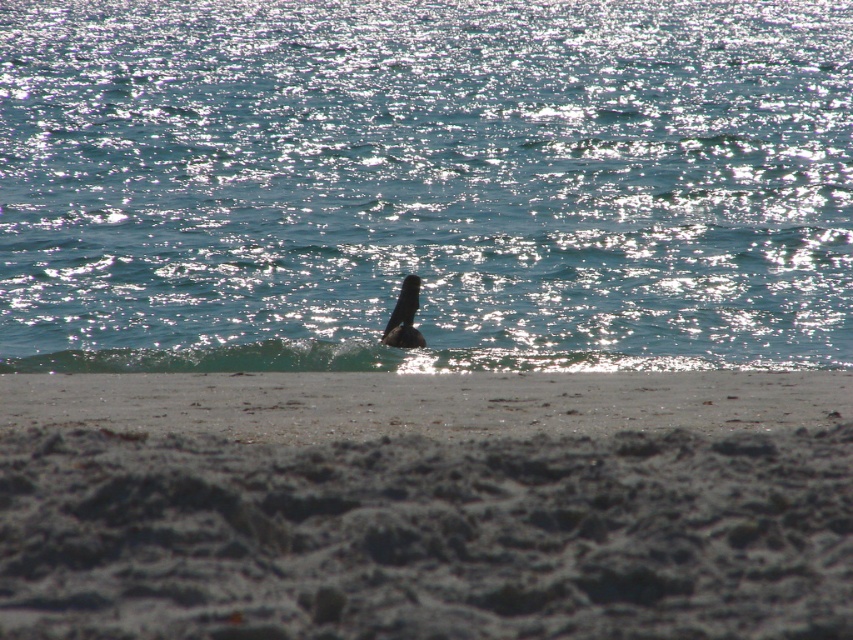
You are a bird flying over the beach and want to land on the gray sandy beach at lower center. However, there are dark brown feathers at center in the way. Which area is wider so you can safely land?

The gray sandy beach at lower center is wider than the dark brown feathers at center, so you can safely land there.

You are standing on the beach and want to walk from the smooth sand at lower center to the shiny blue water at center. Which direction should you move to reach the water?

To reach the shiny blue water at center from the smooth sand at lower center, you should move forward because the shiny blue water at center is wider than the smooth sand at lower center, indicating it extends further out toward the ocean.